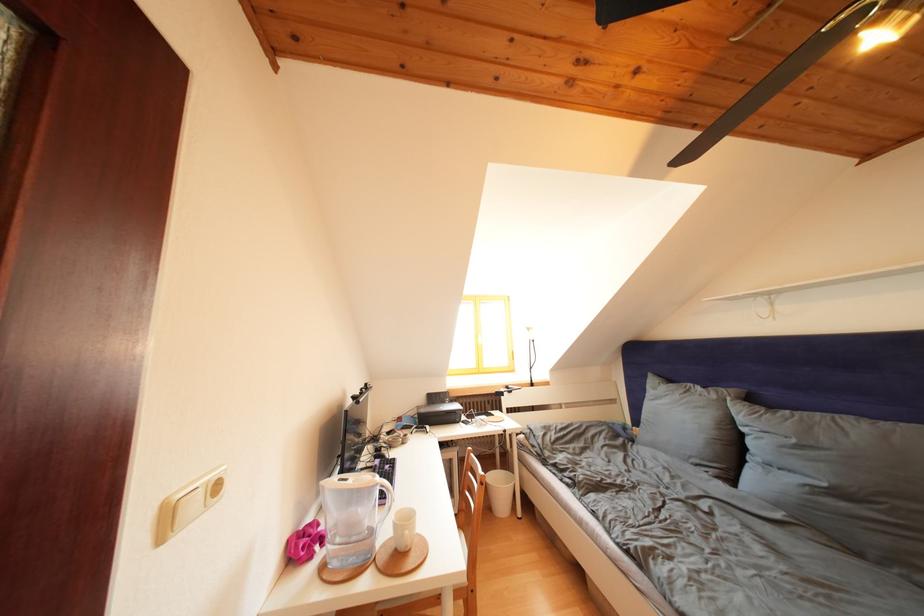
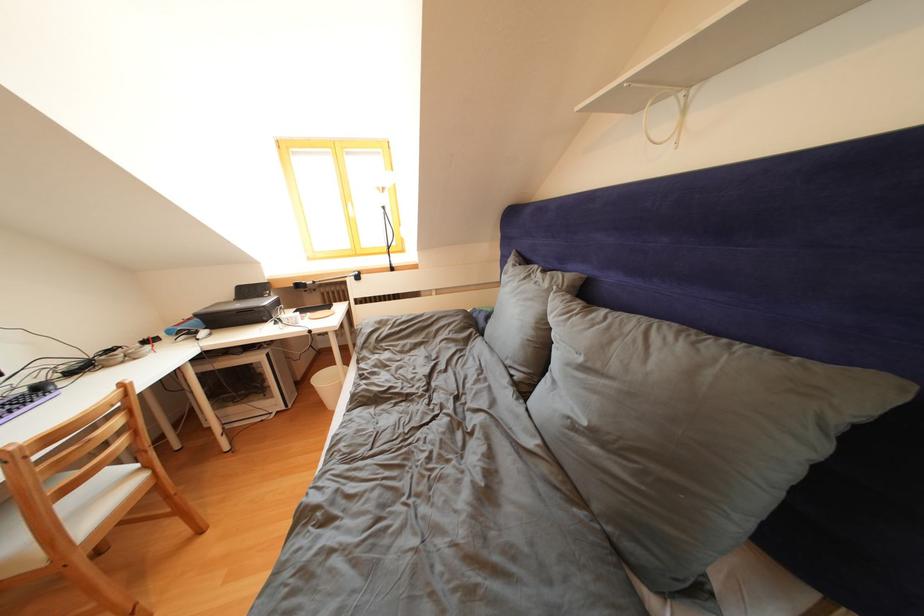
Which direction would the cameraman need to move to produce the second image?

The movement direction of the cameraman is right, forward.